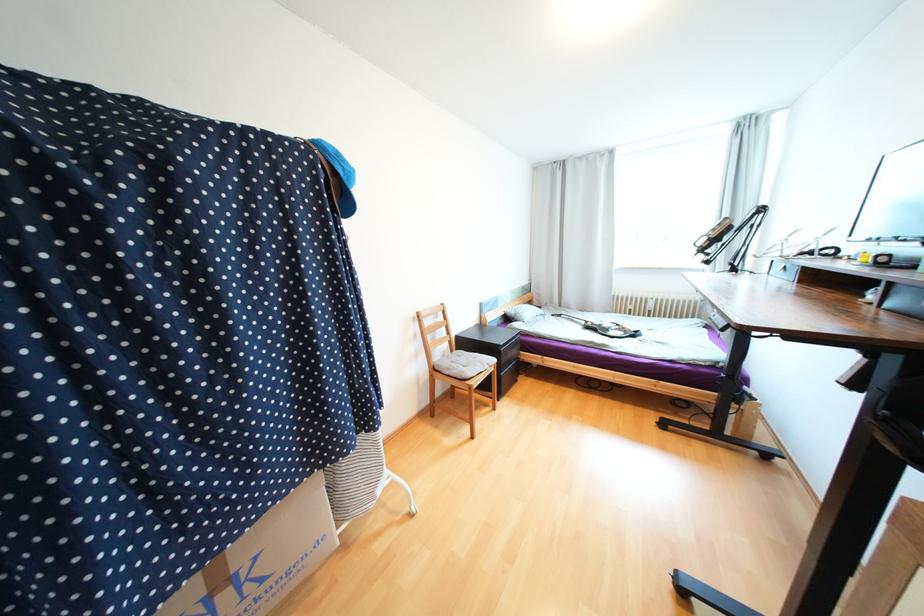
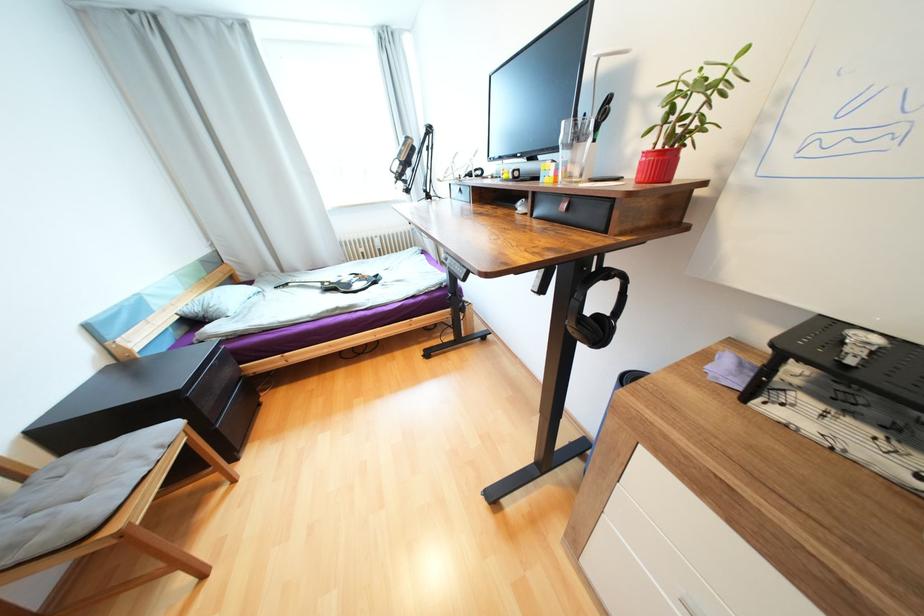
How did the camera likely rotate?

The rotation direction of the camera is right-down.